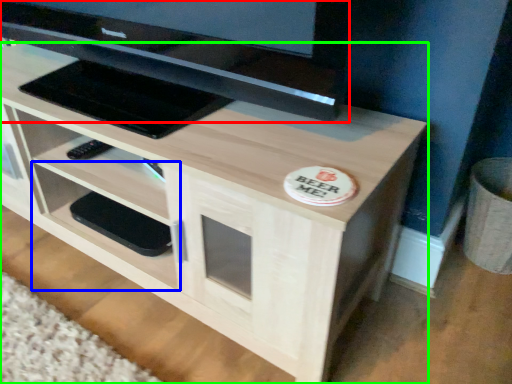
Question: Which is nearer to the television (highlighted by a red box)? shelf (highlighted by a blue box) or desk (highlighted by a green box).

Choices:
 (A) shelf
 (B) desk

Answer: (B)